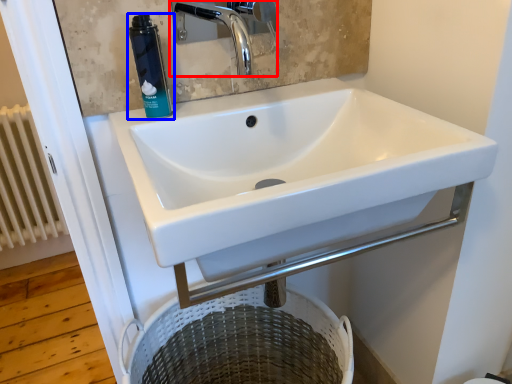
Question: Which of the following is the farthest to the observer, tap (highlighted by a red box) or mouthwash (highlighted by a blue box)?

Choices:
 (A) tap
 (B) mouthwash

Answer: (B)